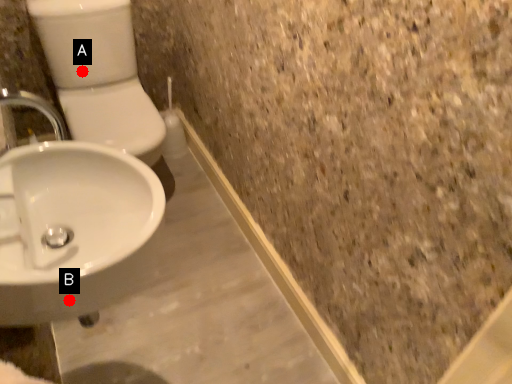
Question: Two points are circled on the image, labeled by A and B beside each circle. Among these points, which one is farthest from the camera?

Choices:
 (A) A is further
 (B) B is further

Answer: (A)